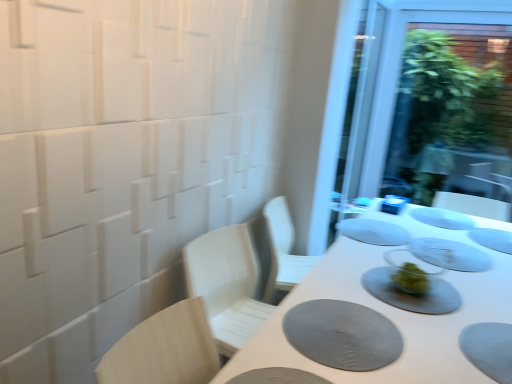
Identify the location of white matte plate at center, the 5th tableware viewed from the front. pos(442,218).

The width and height of the screenshot is (512, 384). What do you see at coordinates (428, 102) in the screenshot?
I see `transparent glass screen door at upper right` at bounding box center [428, 102].

The image size is (512, 384). What are the coordinates of `matte gray placemat at center, the first tableware in the front-to-back sequence` in the screenshot? It's located at (411, 293).

Based on the photo, in order to face gray textured placemat at lower right, should I rotate leftwards or rightwards?

A 11.981 degree turn to the right will do.

The width and height of the screenshot is (512, 384). In order to click on blue plastic container at center, which is the sixth tableware in front-to-back order in this screenshot , I will do `click(393, 204)`.

Between gray textured placemat at lower right and blue plastic container at center, which is the sixth tableware in front-to-back order, which one appears on the left side from the viewer's perspective?

Positioned to the left is gray textured placemat at lower right.

From the image's perspective, which object appears higher, gray textured placemat at lower right or blue plastic container at center, which is the sixth tableware in front-to-back order?

blue plastic container at center, which is the sixth tableware in front-to-back order.

Could you tell me if gray textured placemat at lower right is facing blue plastic container at center, which ranks as the 1th tableware in back-to-front order?

No, gray textured placemat at lower right is not turned towards blue plastic container at center, which ranks as the 1th tableware in back-to-front order.

Does gray textured placemat at lower right have a lesser width compared to blue plastic container at center, which is the sixth tableware in front-to-back order?

Incorrect, the width of gray textured placemat at lower right is not less than that of blue plastic container at center, which is the sixth tableware in front-to-back order.

Is gray textured placemat at lower right wider or thinner than matte gray placemat at center, which is counted as the sixth tableware, starting from the back?

gray textured placemat at lower right is thinner than matte gray placemat at center, which is counted as the sixth tableware, starting from the back.

Is matte gray placemat at center, which is counted as the sixth tableware, starting from the back, a part of gray textured placemat at lower right?

That's incorrect, matte gray placemat at center, which is counted as the sixth tableware, starting from the back, is not inside gray textured placemat at lower right.

Is gray textured placemat at lower right closer to the viewer compared to matte gray placemat at center, the first tableware in the front-to-back sequence?

Yes, it is.

From the image's perspective, is blue plastic container at center, which is the sixth tableware in front-to-back order, beneath matte white plate at center, the 4th tableware when ordered from front to back?

No.

Is blue plastic container at center, which is the sixth tableware in front-to-back order, facing towards matte white plate at center, acting as the 3th tableware starting from the back?

No.

Is there a large distance between blue plastic container at center, which is the sixth tableware in front-to-back order, and matte white plate at center, acting as the 3th tableware starting from the back?

No, blue plastic container at center, which is the sixth tableware in front-to-back order, is not far from matte white plate at center, acting as the 3th tableware starting from the back.

From their relative heights in the image, would you say matte white plate at center, acting as the 3th tableware starting from the back, is taller or shorter than light wood chair at left?

matte white plate at center, acting as the 3th tableware starting from the back, is shorter than light wood chair at left.

Is matte white plate at center, the 4th tableware when ordered from front to back, oriented away from light wood chair at left?

No, matte white plate at center, the 4th tableware when ordered from front to back,'s orientation is not away from light wood chair at left.

Does matte white plate at center, the 4th tableware when ordered from front to back, have a lesser width compared to light wood chair at left?

No, matte white plate at center, the 4th tableware when ordered from front to back, is not thinner than light wood chair at left.

From a real-world perspective, starting from the light wood chair at left, which tableware is the 1st one vertically above it? Please provide its 2D coordinates.

[(373, 232)]

Locate an element on the screen. Image resolution: width=512 pixels, height=384 pixels. tableware that is the 3rd object to the left of the transparent glass screen door at upper right, starting at the anchor is located at coordinates (450, 254).

How distant is clear glass plate at center, the fifth tableware positioned from the back, from transparent glass screen door at upper right?

clear glass plate at center, the fifth tableware positioned from the back, and transparent glass screen door at upper right are 2.15 meters apart.

From the image's perspective, is clear glass plate at center, the fifth tableware positioned from the back, above or below transparent glass screen door at upper right?

clear glass plate at center, the fifth tableware positioned from the back, is situated lower than transparent glass screen door at upper right in the image.

Consider the image. Can you confirm if light wood chair at left is bigger than transparent glass screen door at upper right?

No, light wood chair at left is not bigger than transparent glass screen door at upper right.

Considering the relative sizes of light wood chair at left and transparent glass screen door at upper right in the image provided, is light wood chair at left wider than transparent glass screen door at upper right?

Correct, the width of light wood chair at left exceeds that of transparent glass screen door at upper right.

Which object is positioned more to the left, light wood chair at left or transparent glass screen door at upper right?

light wood chair at left.

How many degrees apart are the facing directions of white matte plate at center, arranged as the 2th tableware when viewed from the back, and blue plastic container at center, which is the sixth tableware in front-to-back order?

The angle between the facing direction of white matte plate at center, arranged as the 2th tableware when viewed from the back, and the facing direction of blue plastic container at center, which is the sixth tableware in front-to-back order, is 89.6 degrees.

Considering their positions, is white matte plate at center, arranged as the 2th tableware when viewed from the back, located in front of or behind blue plastic container at center, which ranks as the 1th tableware in back-to-front order?

Visually, white matte plate at center, arranged as the 2th tableware when viewed from the back, is located in front of blue plastic container at center, which ranks as the 1th tableware in back-to-front order.

Does point (422, 213) appear closer or farther from the camera than point (393, 211)?

Clearly, point (422, 213) is closer to the camera than point (393, 211).

Considering the sizes of objects white matte plate at center, the 5th tableware viewed from the front, and blue plastic container at center, which ranks as the 1th tableware in back-to-front order, in the image provided, who is smaller, white matte plate at center, the 5th tableware viewed from the front, or blue plastic container at center, which ranks as the 1th tableware in back-to-front order,?

With smaller size is white matte plate at center, the 5th tableware viewed from the front.

You are a GUI agent. You are given a task and a screenshot of the screen. Output one action in this format:
    pyautogui.click(x=<x>, y=<y>)
    Task: Click on the 6th tableware behind the gray textured placemat at lower right
    The width and height of the screenshot is (512, 384).
    Given the screenshot: What is the action you would take?
    pyautogui.click(x=393, y=204)

The height and width of the screenshot is (384, 512). I want to click on platter that is below the matte gray placemat at center, which is counted as the sixth tableware, starting from the back (from the image's perspective), so click(342, 335).

Which object lies further to the anchor point clear glass plate at center, which is the 2th tableware from front to back, transparent glass screen door at upper right or white matte table at center?

Among the two, transparent glass screen door at upper right is located further to clear glass plate at center, which is the 2th tableware from front to back.

Considering their positions, is gray textured placemat at lower right positioned closer to gray matte placemat at center, positioned as the 3th tableware in front-to-back order, than transparent glass screen door at upper right?

gray textured placemat at lower right is closer to gray matte placemat at center, positioned as the 3th tableware in front-to-back order.

Looking at the image, which one is located further to gray textured placemat at lower right, white matte table at center or white matte plate at center, the 5th tableware viewed from the front?

The object further to gray textured placemat at lower right is white matte plate at center, the 5th tableware viewed from the front.

Considering their positions, is light wood chair at left positioned further to clear glass plate at center, which is the 2th tableware from front to back, than gray matte placemat at center, which is the 4th tableware in back-to-front order?

Among the two, light wood chair at left is located further to clear glass plate at center, which is the 2th tableware from front to back.

Considering their positions, is clear glass plate at center, which is the 2th tableware from front to back, positioned closer to white matte table at center than matte white plate at center, the 4th tableware when ordered from front to back?

clear glass plate at center, which is the 2th tableware from front to back, lies closer to white matte table at center than the other object.

When comparing their distances from matte white plate at center, acting as the 3th tableware starting from the back, does transparent glass screen door at upper right or gray textured placemat at lower right seem further?

transparent glass screen door at upper right lies further to matte white plate at center, acting as the 3th tableware starting from the back, than the other object.

Considering their positions, is gray matte placemat at center, positioned as the 3th tableware in front-to-back order, positioned closer to white matte plate at center, the 5th tableware viewed from the front, than gray textured placemat at lower right?

Based on the image, gray matte placemat at center, positioned as the 3th tableware in front-to-back order, appears to be nearer to white matte plate at center, the 5th tableware viewed from the front.

Looking at the image, which one is located closer to gray matte placemat at center, which is the 4th tableware in back-to-front order, clear glass plate at center, which is the 2th tableware from front to back, or matte gray placemat at center, the first tableware in the front-to-back sequence?

clear glass plate at center, which is the 2th tableware from front to back, lies closer to gray matte placemat at center, which is the 4th tableware in back-to-front order, than the other object.

Locate an element on the screen. This screenshot has width=512, height=384. platter located between light wood chair at left and transparent glass screen door at upper right in the depth direction is located at coordinates (342, 335).

Find the location of `chair between white matte table at center and blue plastic container at center, which ranks as the 1th tableware in back-to-front order, in the front-back direction`. chair between white matte table at center and blue plastic container at center, which ranks as the 1th tableware in back-to-front order, in the front-back direction is located at coordinates (164, 349).

Image resolution: width=512 pixels, height=384 pixels. I want to click on platter between light wood chair at left and white matte plate at center, the 5th tableware viewed from the front, from front to back, so click(x=342, y=335).

At what (x,y) coordinates should I click in order to perform the action: click on platter between white matte table at center and matte white plate at center, the 4th tableware when ordered from front to back, along the z-axis. Please return your answer as a coordinate pair (x, y). This screenshot has width=512, height=384. Looking at the image, I should click on (342, 335).